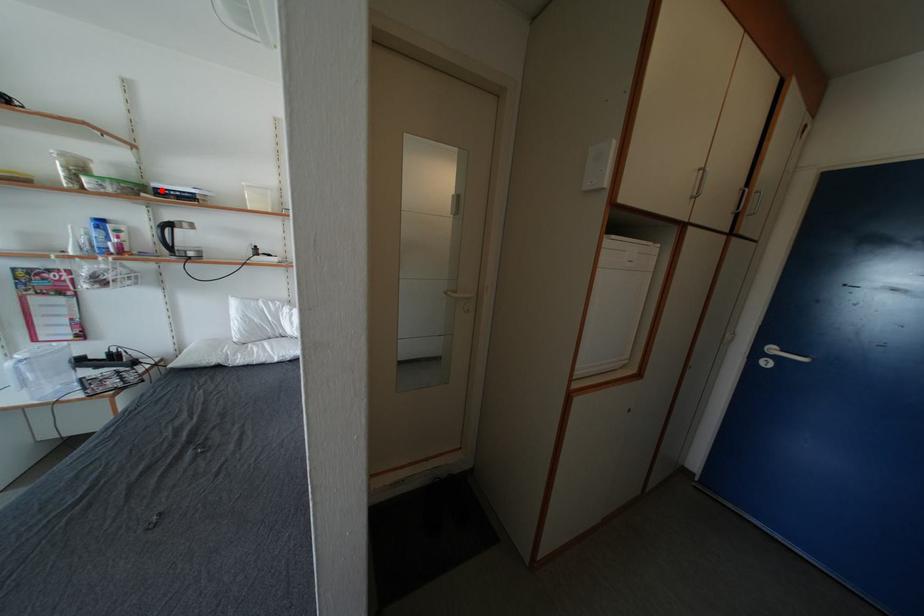
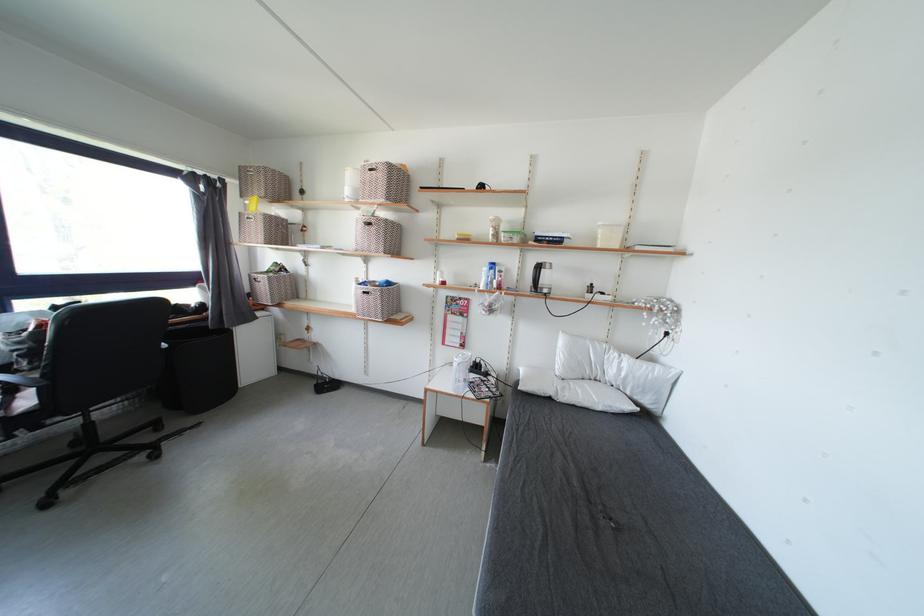
The point at the highlighted location is marked in the first image. Where is the corresponding point in the second image?

(543, 238)